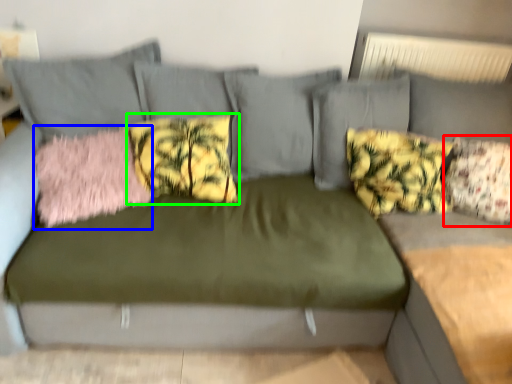
Question: Considering the real-world distances, which object is farthest from pillow (highlighted by a red box)? pillow (highlighted by a blue box) or pillow (highlighted by a green box)?

Choices:
 (A) pillow
 (B) pillow

Answer: (A)